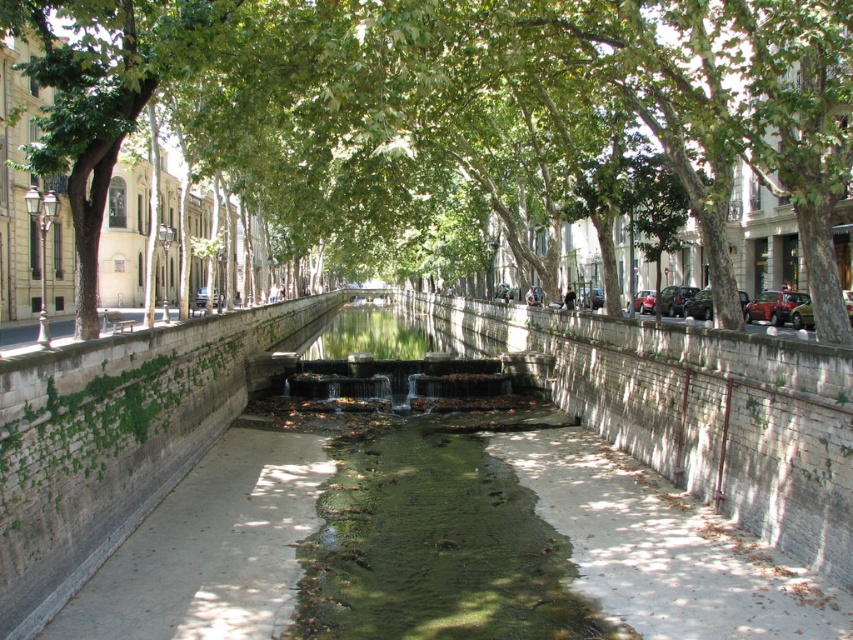
Question: Does green leafy tree at center have a greater width compared to smooth concrete pavement at center?

Choices:
 (A) yes
 (B) no

Answer: (A)

Question: Does green leafy tree at center have a greater width compared to smooth concrete pavement at center?

Choices:
 (A) no
 (B) yes

Answer: (B)

Question: Which of the following is the farthest from the observer?

Choices:
 (A) smooth concrete pavement at center
 (B) green leafy tree at center

Answer: (B)

Question: Is green leafy tree at center below smooth concrete pavement at center?

Choices:
 (A) no
 (B) yes

Answer: (A)